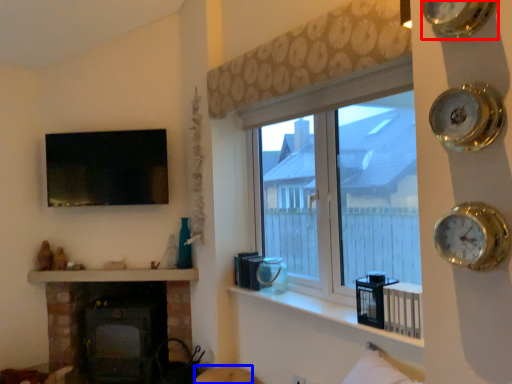
Question: Among these objects, which one is nearest to the camera, clock (highlighted by a red box) or furniture (highlighted by a blue box)?

Choices:
 (A) clock
 (B) furniture

Answer: (A)